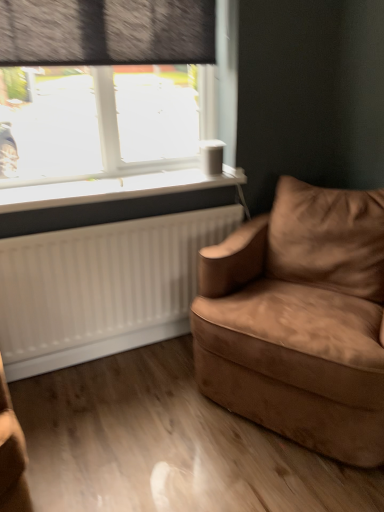
In order to click on vacant area on top of white plastic window sill at upper left (from a real-world perspective) in this screenshot , I will do `click(108, 181)`.